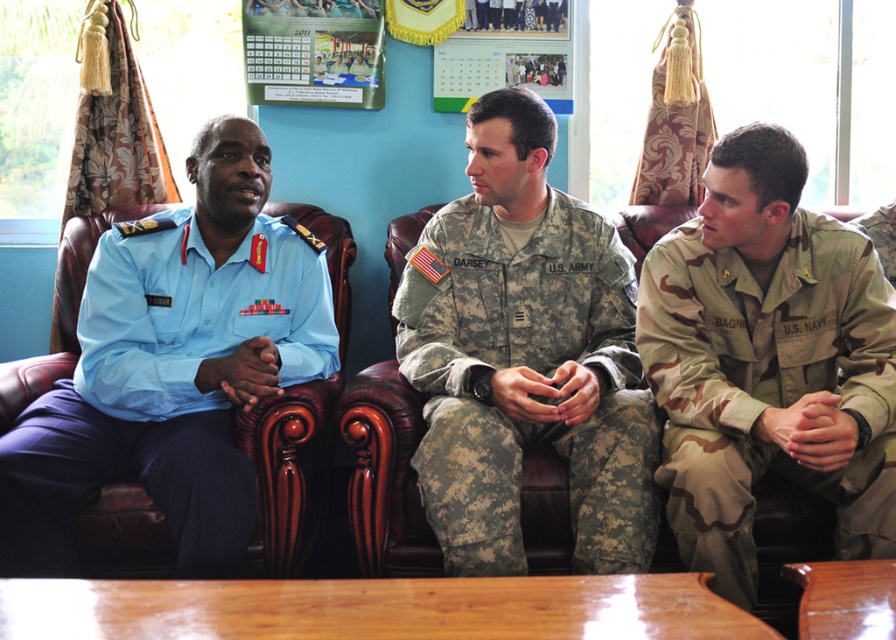
You are a tailor who needs to determine which uniform requires more fabric to make between the light blue uniform at left and the camouflage fabric us army uniform at center. Which one needs more fabric?

The light blue uniform at left requires more fabric than the camouflage fabric us army uniform at center because it is bigger.

You are a furniture designer trying to determine if the brown leather couch at center can fit under a standard ceiling height of 2.5 meters. Given that the camouflage fabric us navy uniform at right is taller than the couch, and the uniform is 1.8 meters tall, will the couch fit under the ceiling?

The camouflage fabric us navy uniform at right is 1.8 meters tall and taller than the brown leather couch at center. Since the couch is shorter than 1.8 meters, it will fit under the 2.5 meter ceiling.